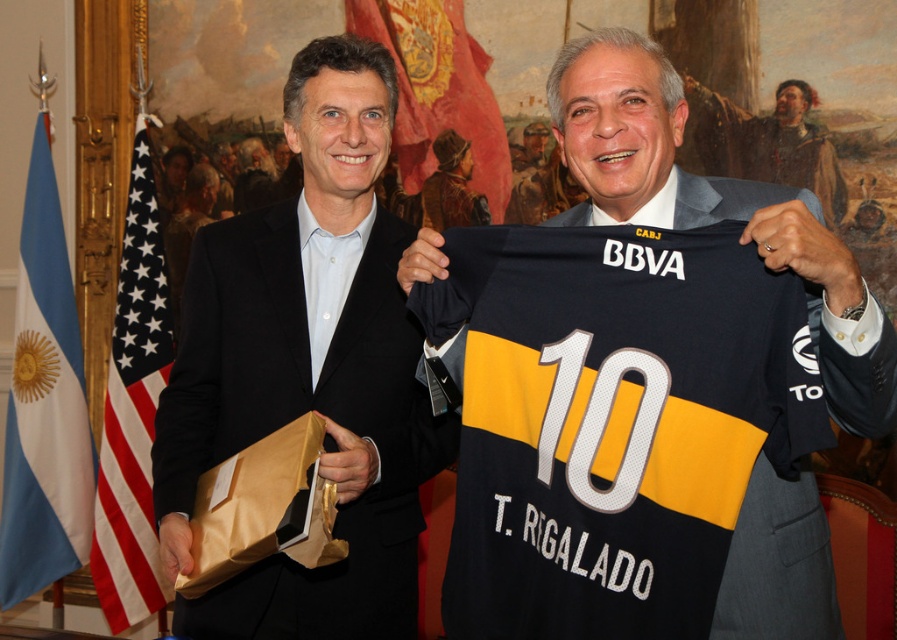
Question: Estimate the real-world distances between objects in this image. Which object is farther from the matte black suit at left?

Choices:
 (A) black jersey at center
 (B) white smooth shirt at center

Answer: (A)

Question: Which point is farther to the camera?

Choices:
 (A) brown leather jacket at upper center
 (B) black jersey at center
 (C) matte black suit at left
 (D) white smooth shirt at center

Answer: (A)

Question: From the image, what is the correct spatial relationship of black jersey at center in relation to brown leather jacket at upper center?

Choices:
 (A) above
 (B) below

Answer: (B)

Question: Can you confirm if black jersey at center is positioned to the right of white smooth shirt at center?

Choices:
 (A) no
 (B) yes

Answer: (B)

Question: Does brown leather jacket at upper center appear on the right side of white smooth shirt at center?

Choices:
 (A) no
 (B) yes

Answer: (B)

Question: Which of the following is the farthest from the observer?

Choices:
 (A) matte black suit at left
 (B) black jersey at center
 (C) white smooth shirt at center

Answer: (C)